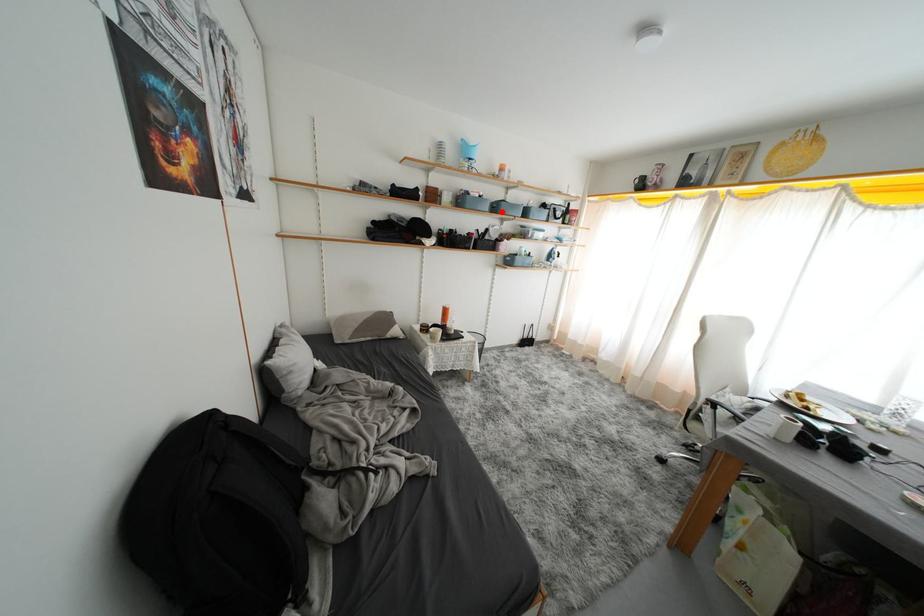
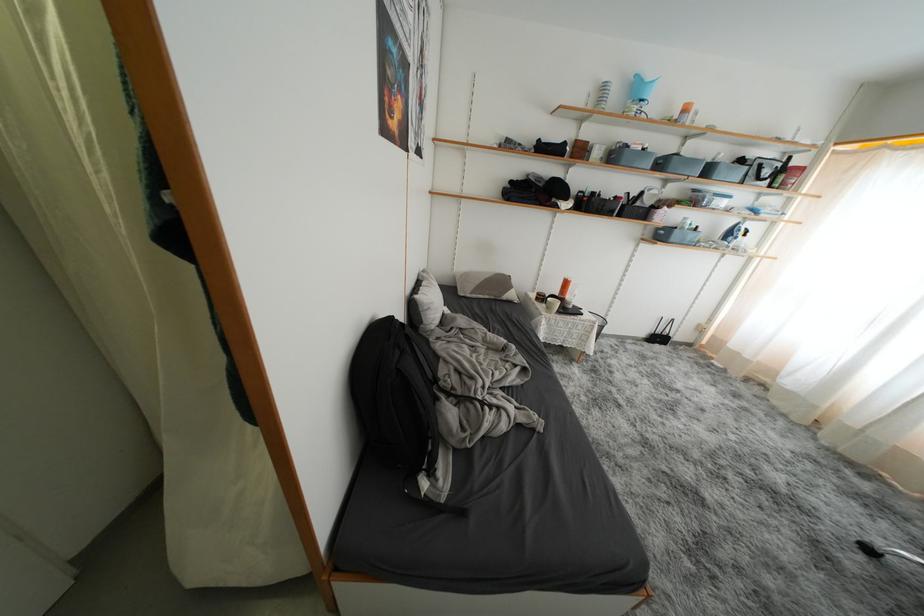
The point at the highlighted location is marked in the first image. Where is the corresponding point in the second image?

(667, 168)